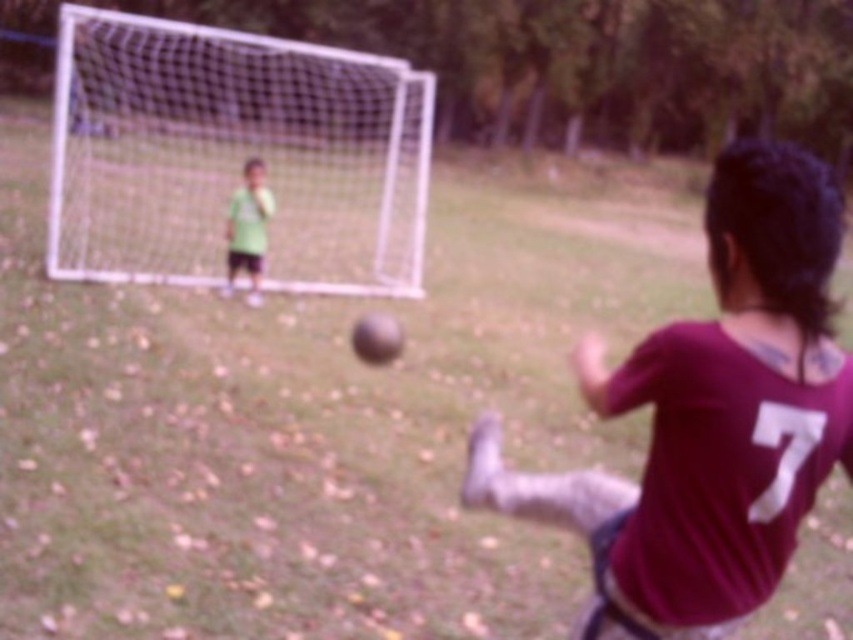
You are a soccer coach analyzing the field layout. You notice the white mesh net at upper left and the green matte shirt at upper left. Which object occupies more space in the image?

The white mesh net at upper left is bigger than the green matte shirt at upper left, so the white mesh net at upper left occupies more space in the image.

You are a soccer coach analyzing a player position in the image. The player wearing the maroon jersey at center is in which area of the field? Please provide coordinates in the format of x,y where x and y are between 0 and 1, with 0,0 being the bottom left corner and 1,1 being the top right corner.

The maroon jersey at center is located at coordinates (714, 413).